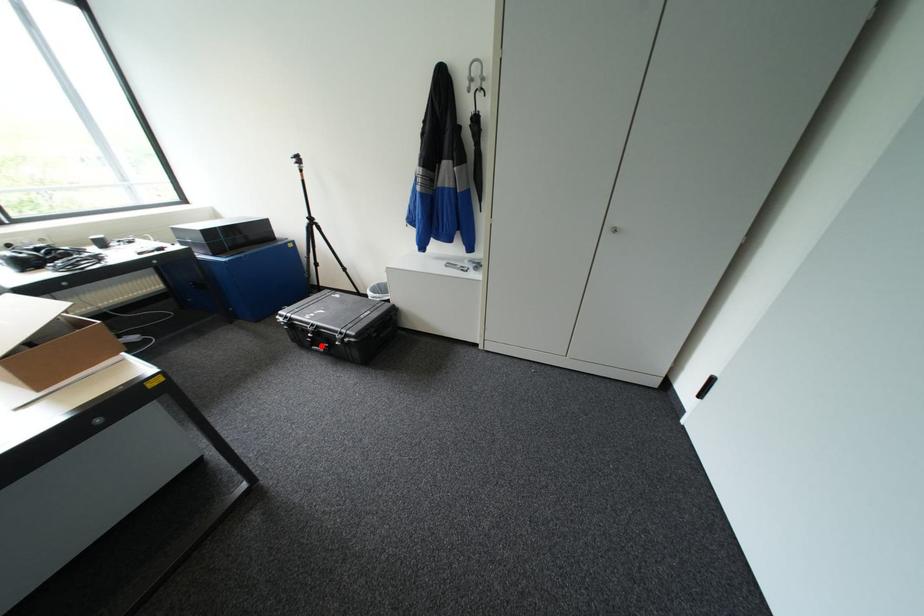
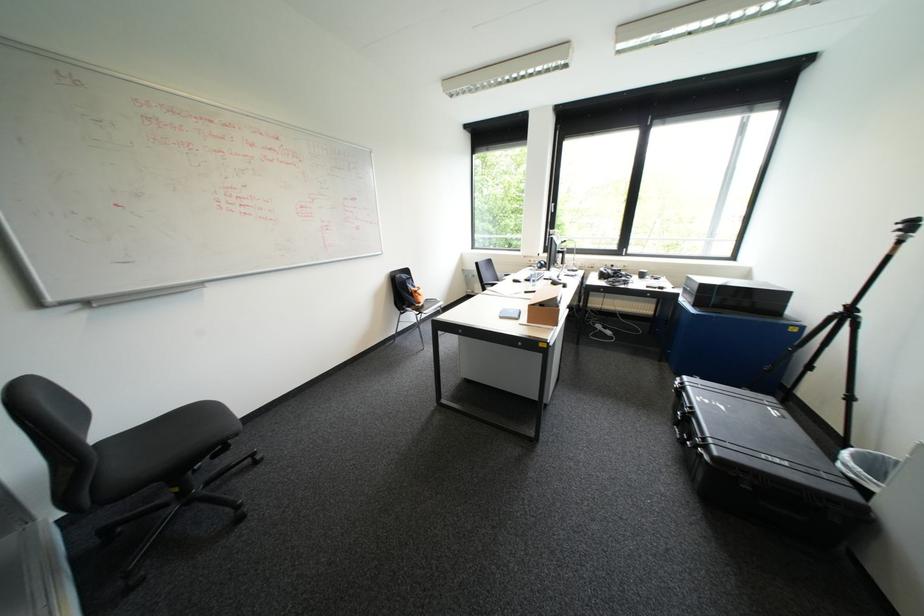
Locate, in the second image, the point that corresponds to the highlighted location in the first image.

(684, 426)